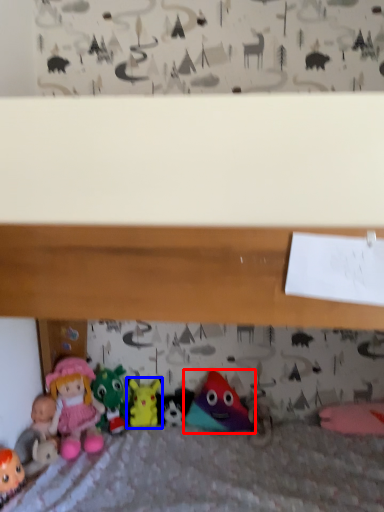
Question: Which object is closer to the camera taking this photo, toy (highlighted by a red box) or toy (highlighted by a blue box)?

Choices:
 (A) toy
 (B) toy

Answer: (A)